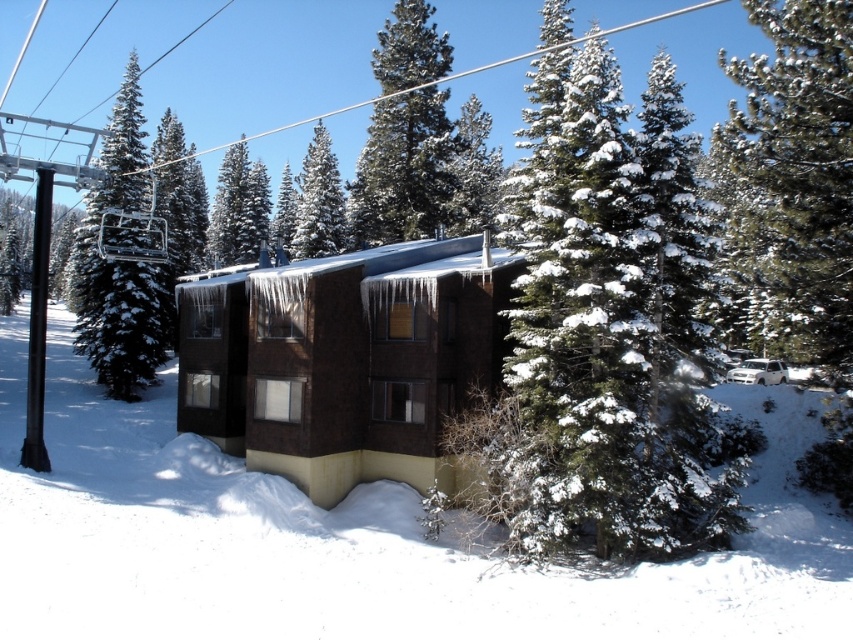
You are standing in front of the two story building and want to determine the distance between the two points. Given that point A is at coordinate point (485, 260) and point B is at coordinate point (340, 248), which point is closer to you?

Point A at coordinate point (485, 260) is closer to the viewer than point B at coordinate point (340, 248).

You are standing at the point marked by the coordinates point [120,262] in the image. What object are you standing on?

You are standing on the snow covered pine tree at left.